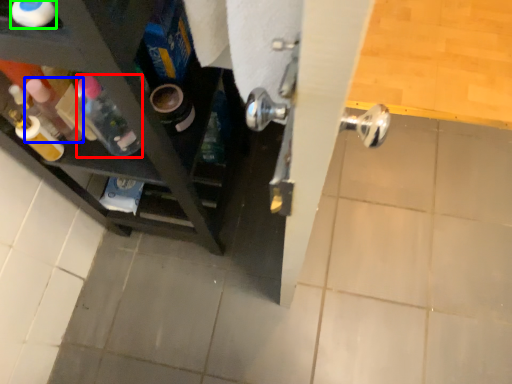
Question: Which is farther away from bottle (highlighted by a red box)? bottle (highlighted by a blue box) or bottle (highlighted by a green box)?

Choices:
 (A) bottle
 (B) bottle

Answer: (B)